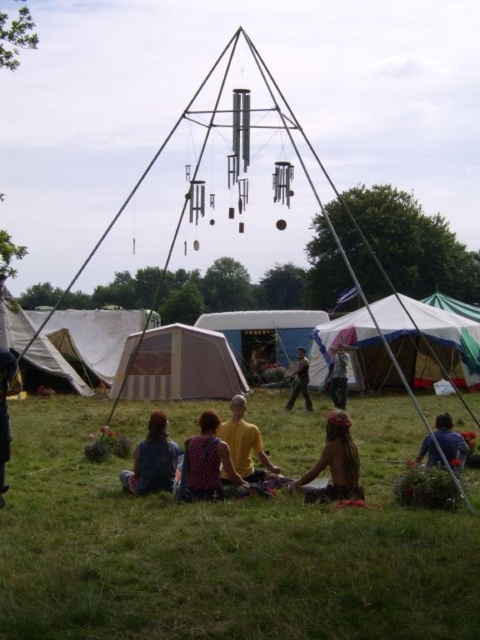
Question: Is camouflage fabric tent at lower left closer to the viewer compared to camouflage fabric person at center?

Choices:
 (A) yes
 (B) no

Answer: (B)

Question: Observing the image, what is the correct spatial positioning of denim jacket at lower left in reference to yellow t-shirt at center?

Choices:
 (A) right
 (B) left

Answer: (B)

Question: Which point appears farthest from the camera in this image?

Choices:
 (A) (321, 499)
 (B) (184, 444)
 (C) (156, 324)
 (D) (173, 465)

Answer: (C)

Question: Which point is closer to the camera?

Choices:
 (A) dark blue fabric at lower left
 (B) brown leather bag at center
 (C) striped canvas tent at lower left
 (D) camouflage fabric person at center

Answer: (A)

Question: Based on their relative distances, which object is farther from the white canvas tent at center?

Choices:
 (A) striped canvas tent at lower left
 (B) green grass at lower center

Answer: (A)

Question: In this image, where is striped canvas tent at lower left located relative to yellow t-shirt at center?

Choices:
 (A) right
 (B) left

Answer: (B)